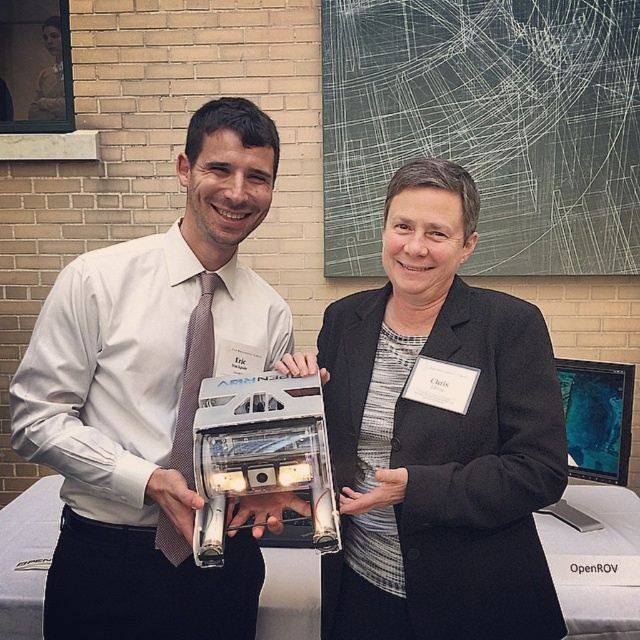
You are standing in the same room as the two people in the image. You want to hand a document to the person wearing the matte white shirt at center without disturbing the person in the matte black jacket at center. Which direction should you approach from?

You should approach from the front of the matte white shirt at center because it is closer to you than the matte black jacket at center, so you can reach them without getting close to the other person.

You are organizing a photo shoot and need to decide which clothing item to highlight based on size. Given the scene, which item between the matte white shirt at center and the matte black jacket at center should you choose to emphasize its prominence?

The matte white shirt at center is larger in size than the matte black jacket at center, so you should choose the matte white shirt at center to emphasize its prominence due to its bigger size.